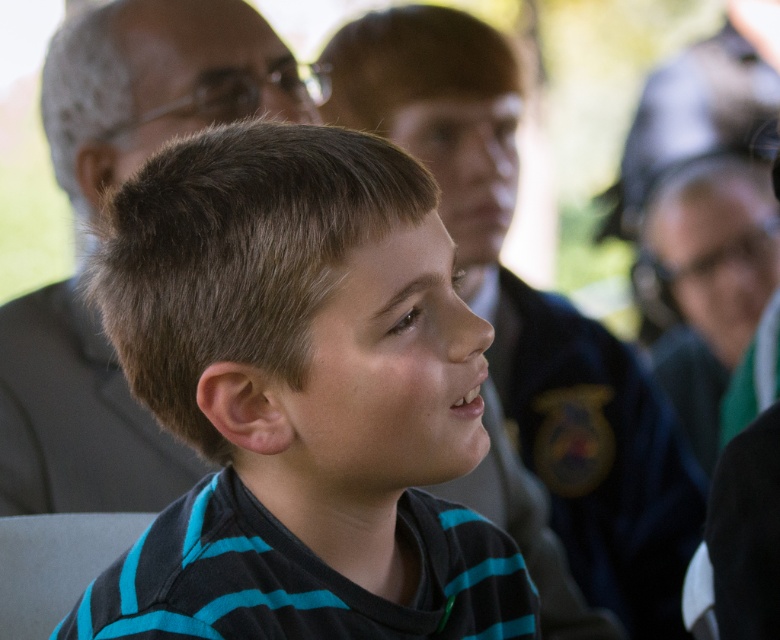
You are standing at the position of point (169, 33) and want to move to the front of the room. Which direction should you move in relation to point (426, 314)?

To move to the front of the room from point (169, 33), you should move towards point (426, 314) since it is located in front of your current position.

You are an event planner trying to arrange seating for a formal dinner. You need to place the blue striped shirt at center and the dark gray suit at upper left such that the taller object is seated in the front row. Based on the image, which object should be placed in the front row?

The blue striped shirt at center is taller than the dark gray suit at upper left, so the blue striped shirt at center should be placed in the front row.